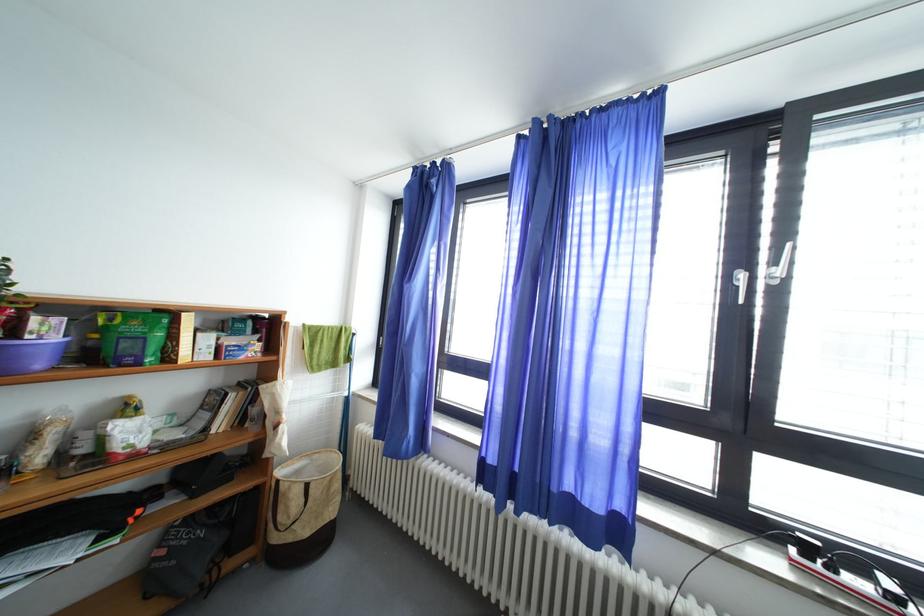
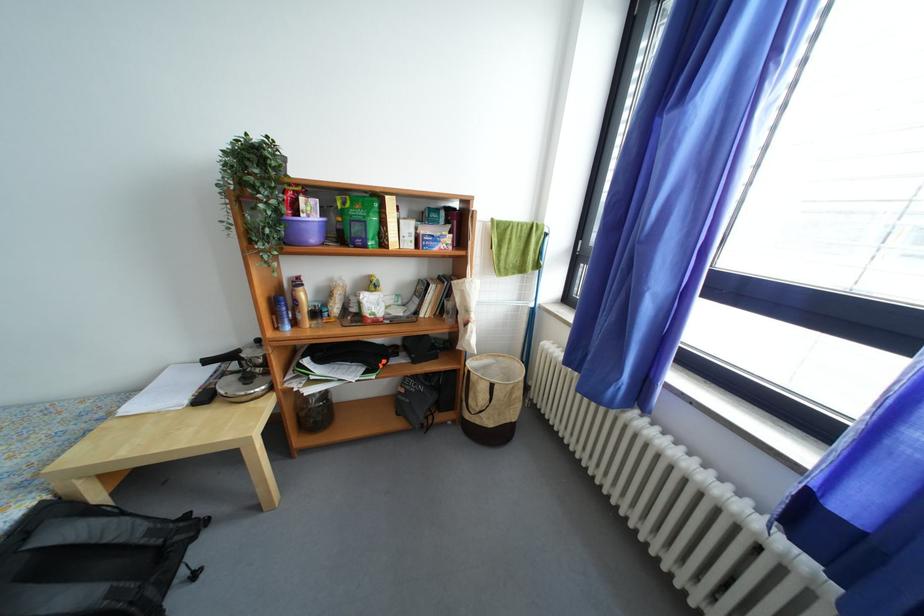
First-person continuous shooting, in which direction is the camera rotating?

The camera's rotation is toward left-down.